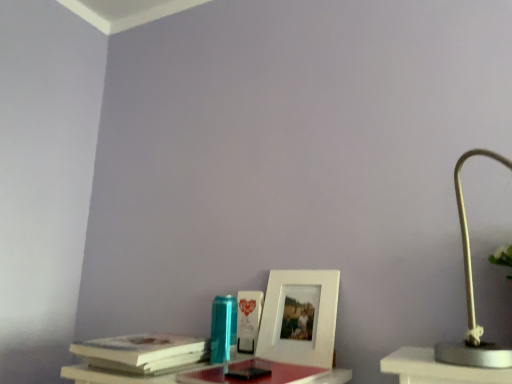
Question: Does white paper at left have a greater height compared to white matte lamp at right?

Choices:
 (A) yes
 (B) no

Answer: (B)

Question: Is white paper at left further to the viewer compared to white matte lamp at right?

Choices:
 (A) no
 (B) yes

Answer: (B)

Question: Can you confirm if white paper at left is smaller than white matte lamp at right?

Choices:
 (A) no
 (B) yes

Answer: (B)

Question: Is white paper at left at the right side of white matte lamp at right?

Choices:
 (A) no
 (B) yes

Answer: (A)

Question: Could white matte lamp at right be considered to be inside white paper at left?

Choices:
 (A) yes
 (B) no

Answer: (B)

Question: From the image's perspective, is white matte picture frame at center above or below white paper at left?

Choices:
 (A) above
 (B) below

Answer: (A)

Question: Considering their positions, is white matte picture frame at center located in front of or behind white paper at left?

Choices:
 (A) front
 (B) behind

Answer: (B)

Question: Is white matte picture frame at center inside or outside of white paper at left?

Choices:
 (A) outside
 (B) inside

Answer: (A)

Question: Is white matte picture frame at center wider or thinner than white paper at left?

Choices:
 (A) wide
 (B) thin

Answer: (B)

Question: Considering the positions of white matte lamp at right and white matte picture frame at center in the image, is white matte lamp at right taller or shorter than white matte picture frame at center?

Choices:
 (A) short
 (B) tall

Answer: (B)

Question: From a real-world perspective, is white matte lamp at right above or below white matte picture frame at center?

Choices:
 (A) below
 (B) above

Answer: (B)

Question: Is white matte lamp at right wider or thinner than white matte picture frame at center?

Choices:
 (A) wide
 (B) thin

Answer: (A)

Question: Is white matte lamp at right situated inside white matte picture frame at center or outside?

Choices:
 (A) outside
 (B) inside

Answer: (A)

Question: Looking at the image, does white paper at left seem bigger or smaller compared to white matte picture frame at center?

Choices:
 (A) big
 (B) small

Answer: (A)

Question: In terms of width, does white paper at left look wider or thinner when compared to white matte picture frame at center?

Choices:
 (A) wide
 (B) thin

Answer: (A)